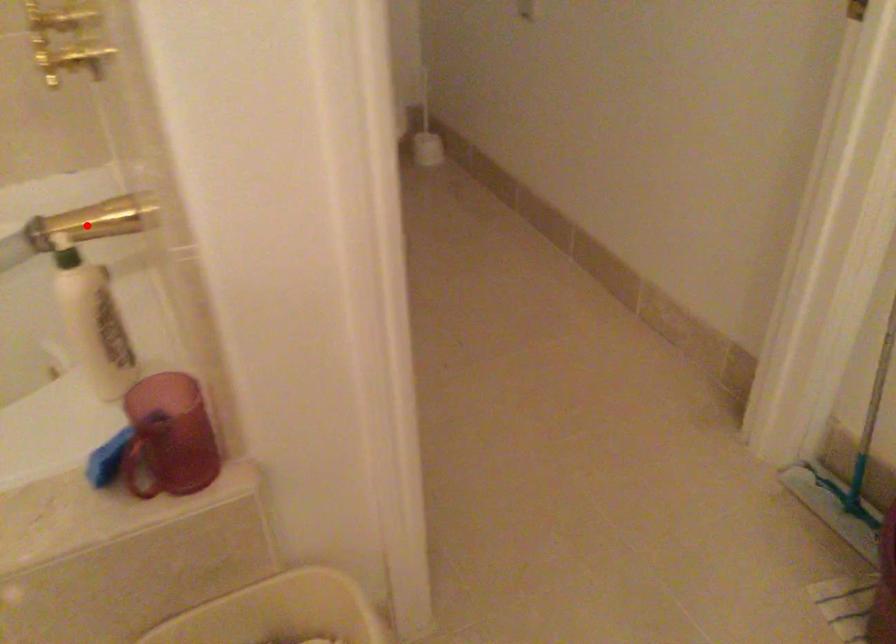
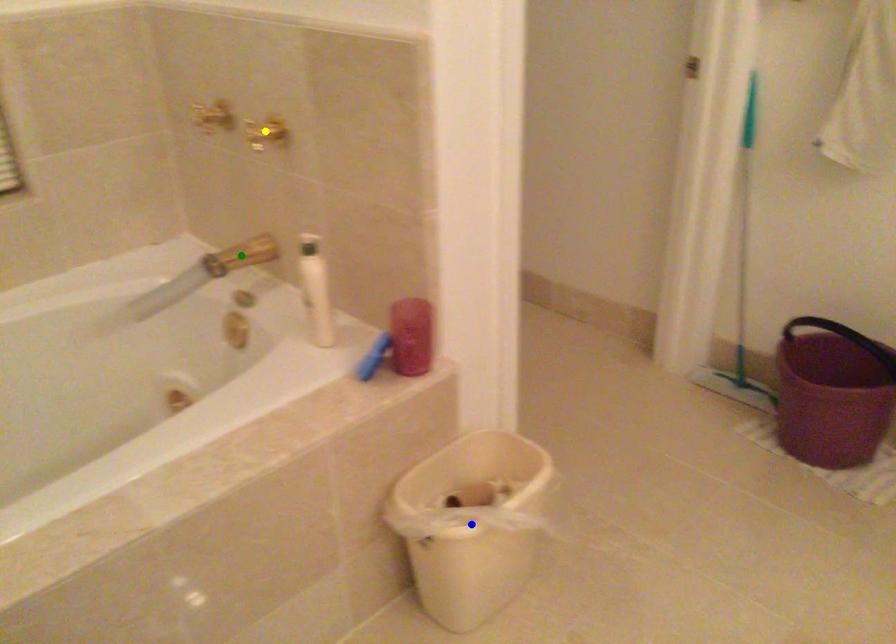
Question: I am providing you with two images of the same scene from different viewpoints. A red point is marked on the first image. You are given multiple points on the second image. Which mark in image 2 goes with the point in image 1?

Choices:
 (A) blue point
 (B) green point
 (C) yellow point

Answer: (B)